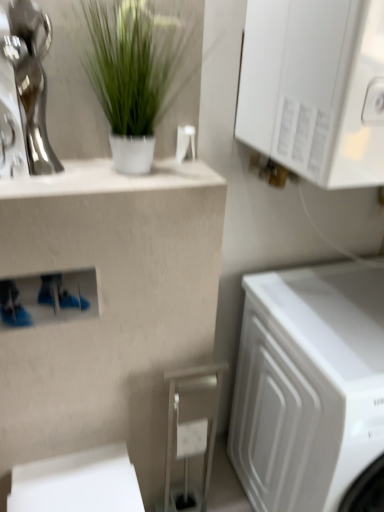
Question: From the image's perspective, does white glossy cabinet at upper right appear lower than white glossy counter top at upper left?

Choices:
 (A) no
 (B) yes

Answer: (A)

Question: Is white glossy cabinet at upper right smaller than white glossy counter top at upper left?

Choices:
 (A) no
 (B) yes

Answer: (A)

Question: Does white glossy cabinet at upper right have a greater height compared to white glossy counter top at upper left?

Choices:
 (A) yes
 (B) no

Answer: (A)

Question: Can you confirm if white glossy cabinet at upper right is positioned to the left of white glossy counter top at upper left?

Choices:
 (A) no
 (B) yes

Answer: (A)

Question: Considering the relative positions of white glossy cabinet at upper right and white glossy counter top at upper left in the image provided, is white glossy cabinet at upper right behind white glossy counter top at upper left?

Choices:
 (A) yes
 (B) no

Answer: (B)

Question: Based on their sizes in the image, would you say white glossy cabinet at upper right is bigger or smaller than matte beige stool at lower center?

Choices:
 (A) big
 (B) small

Answer: (A)

Question: From a real-world perspective, relative to matte beige stool at lower center, is white glossy cabinet at upper right vertically above or below?

Choices:
 (A) above
 (B) below

Answer: (A)

Question: Is point (357, 112) closer or farther from the camera than point (178, 505)?

Choices:
 (A) farther
 (B) closer

Answer: (B)

Question: Is white glossy cabinet at upper right spatially inside matte beige stool at lower center, or outside of it?

Choices:
 (A) outside
 (B) inside

Answer: (A)

Question: From a real-world perspective, relative to shiny silver statue at upper left, is white glossy cabinet at upper right vertically above or below?

Choices:
 (A) below
 (B) above

Answer: (B)

Question: Considering the positions of white glossy cabinet at upper right and shiny silver statue at upper left in the image, is white glossy cabinet at upper right taller or shorter than shiny silver statue at upper left?

Choices:
 (A) short
 (B) tall

Answer: (B)

Question: Is white glossy cabinet at upper right bigger or smaller than shiny silver statue at upper left?

Choices:
 (A) big
 (B) small

Answer: (A)

Question: Is white glossy cabinet at upper right to the left or to the right of shiny silver statue at upper left in the image?

Choices:
 (A) right
 (B) left

Answer: (A)

Question: Visually, is matte beige stool at lower center positioned to the left or to the right of shiny silver statue at upper left?

Choices:
 (A) right
 (B) left

Answer: (A)

Question: Based on their sizes in the image, would you say matte beige stool at lower center is bigger or smaller than shiny silver statue at upper left?

Choices:
 (A) small
 (B) big

Answer: (B)